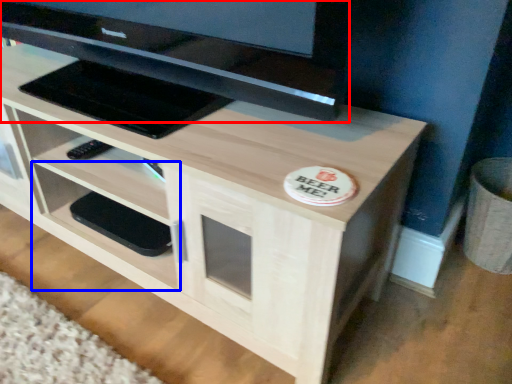
Question: Which object is closer to the camera taking this photo, television (highlighted by a red box) or shelf (highlighted by a blue box)?

Choices:
 (A) television
 (B) shelf

Answer: (A)